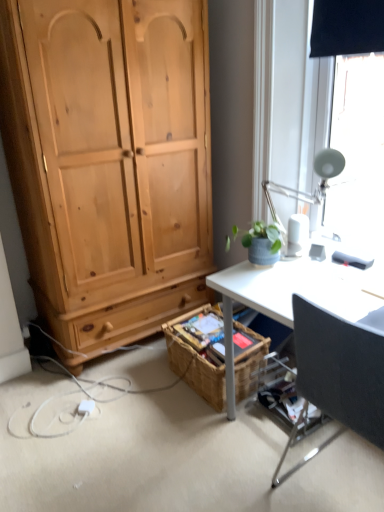
Image resolution: width=384 pixels, height=512 pixels. What do you see at coordinates (196, 364) in the screenshot?
I see `woven brown picnic basket at lower center` at bounding box center [196, 364].

Find the location of a particular element. The width and height of the screenshot is (384, 512). white metallic lamp at upper right is located at coordinates (305, 192).

Is black fabric chair at right facing away from woven brown picnic basket at lower center?

black fabric chair at right does not have its back to woven brown picnic basket at lower center.

Which point is more forward, (x=347, y=409) or (x=244, y=330)?

The point (x=347, y=409) is in front.

Between black fabric chair at right and woven brown picnic basket at lower center, which one has larger size?

black fabric chair at right is bigger.

Are white plastic power outlet at lower left and woven brown picnic basket at lower center making contact?

No, white plastic power outlet at lower left is not next to woven brown picnic basket at lower center.

Between white plastic power outlet at lower left and woven brown picnic basket at lower center, which one appears on the right side from the viewer's perspective?

woven brown picnic basket at lower center.

Can you confirm if white plastic power outlet at lower left is thinner than woven brown picnic basket at lower center?

Correct, the width of white plastic power outlet at lower left is less than that of woven brown picnic basket at lower center.

Is white metallic lamp at upper right inside or outside of white plastic power outlet at lower left?

The correct answer is: outside.

Can you confirm if white metallic lamp at upper right is bigger than white plastic power outlet at lower left?

Yes, white metallic lamp at upper right is bigger than white plastic power outlet at lower left.

From the image's perspective, is white metallic lamp at upper right on white plastic power outlet at lower left?

Yes, from the image's perspective, white metallic lamp at upper right is over white plastic power outlet at lower left.

Is white metallic lamp at upper right looking in the opposite direction of white plastic power outlet at lower left?

No, white metallic lamp at upper right's orientation is not away from white plastic power outlet at lower left.

From the image's perspective, between white plastic power outlet at lower left and white metallic lamp at upper right, who is located below?

white plastic power outlet at lower left appears lower in the image.

Would you say white plastic power outlet at lower left is outside white metallic lamp at upper right?

white plastic power outlet at lower left lies outside white metallic lamp at upper right's area.

Looking at this image, is white plastic power outlet at lower left placed right next to white metallic lamp at upper right?

No, white plastic power outlet at lower left is not touching white metallic lamp at upper right.

Does woven brown picnic basket at lower center have a greater height compared to white plastic power outlet at lower left?

Yes, woven brown picnic basket at lower center is taller than white plastic power outlet at lower left.

From the picture: From a real-world perspective, is woven brown picnic basket at lower center physically above white plastic power outlet at lower left?

Yes.

In terms of size, does woven brown picnic basket at lower center appear bigger or smaller than white plastic power outlet at lower left?

Clearly, woven brown picnic basket at lower center is larger in size than white plastic power outlet at lower left.

Locate an element on the screen. This screenshot has width=384, height=512. picnic basket above the white plastic power outlet at lower left (from a real-world perspective) is located at coordinates (196, 364).

Can we say white metallic lamp at upper right lies outside black fabric chair at right?

Indeed, white metallic lamp at upper right is completely outside black fabric chair at right.

Is white metallic lamp at upper right positioned with its back to black fabric chair at right?

No, white metallic lamp at upper right is not facing the opposite direction of black fabric chair at right.

Which is in front, point (304, 195) or point (310, 354)?

Point (310, 354)

Based on their positions, is white metallic lamp at upper right located to the left or right of black fabric chair at right?

white metallic lamp at upper right is to the left of black fabric chair at right.

Could you tell me if woven brown picnic basket at lower center is facing green matte plant pot at upper right?

No, woven brown picnic basket at lower center is not facing towards green matte plant pot at upper right.

From the image's perspective, is woven brown picnic basket at lower center above green matte plant pot at upper right?

Actually, woven brown picnic basket at lower center appears below green matte plant pot at upper right in the image.

Does point (190, 373) appear closer or farther from the camera than point (266, 238)?

Point (190, 373) appears to be farther away from the viewer than point (266, 238).

Looking at their sizes, would you say woven brown picnic basket at lower center is wider or thinner than green matte plant pot at upper right?

woven brown picnic basket at lower center is wider than green matte plant pot at upper right.

This screenshot has width=384, height=512. I want to click on chair on the right of woven brown picnic basket at lower center, so click(x=337, y=375).

Identify the location of picnic basket that appears in front of the white plastic power outlet at lower left. This screenshot has height=512, width=384. (196, 364).

Consider the image. Looking at the image, which one is located further to white metallic lamp at upper right, white plastic power outlet at lower left or woven brown picnic basket at lower center?

Based on the image, white plastic power outlet at lower left appears to be further to white metallic lamp at upper right.

Based on their spatial positions, is woven brown picnic basket at lower center or white plastic power outlet at lower left closer to green matte plant pot at upper right?

woven brown picnic basket at lower center.

When comparing their distances from black fabric chair at right, does green matte plant pot at upper right or white metallic lamp at upper right seem closer?

green matte plant pot at upper right lies closer to black fabric chair at right than the other object.

Which object lies nearer to the anchor point woven brown picnic basket at lower center, white plastic power outlet at lower left or black fabric chair at right?

The object closer to woven brown picnic basket at lower center is white plastic power outlet at lower left.

When comparing their distances from white plastic power outlet at lower left, does black fabric chair at right or green matte plant pot at upper right seem further?

black fabric chair at right is positioned further to the anchor white plastic power outlet at lower left.

Estimate the real-world distances between objects in this image. Which object is closer to woven brown picnic basket at lower center, green matte plant pot at upper right or white plastic power outlet at lower left?

Among the two, green matte plant pot at upper right is located nearer to woven brown picnic basket at lower center.

Looking at the image, which one is located closer to black fabric chair at right, green matte plant pot at upper right or woven brown picnic basket at lower center?

The object closer to black fabric chair at right is green matte plant pot at upper right.

Looking at the image, which one is located further to green matte plant pot at upper right, white metallic lamp at upper right or woven brown picnic basket at lower center?

woven brown picnic basket at lower center.

Image resolution: width=384 pixels, height=512 pixels. I want to click on houseplant between white metallic lamp at upper right and black fabric chair at right in the up-down direction, so click(260, 242).

Where is `lamp between white plastic power outlet at lower left and black fabric chair at right from left to right`? lamp between white plastic power outlet at lower left and black fabric chair at right from left to right is located at coordinates point(305,192).

Locate an element on the screen. This screenshot has height=512, width=384. houseplant between white plastic power outlet at lower left and white metallic lamp at upper right in the horizontal direction is located at coordinates (260, 242).

Where is `lamp between black fabric chair at right and woven brown picnic basket at lower center from front to back`? The image size is (384, 512). lamp between black fabric chair at right and woven brown picnic basket at lower center from front to back is located at coordinates (305, 192).